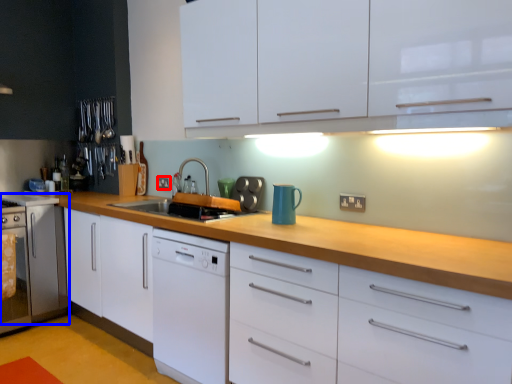
Question: Which object appears closest to the camera in this image, electric outlet (highlighted by a red box) or appliance (highlighted by a blue box)?

Choices:
 (A) electric outlet
 (B) appliance

Answer: (B)